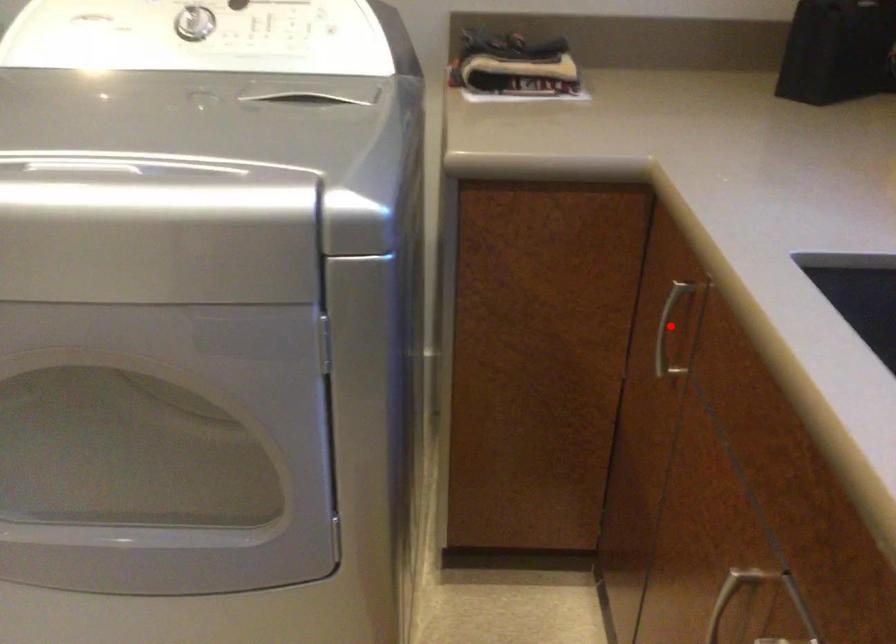
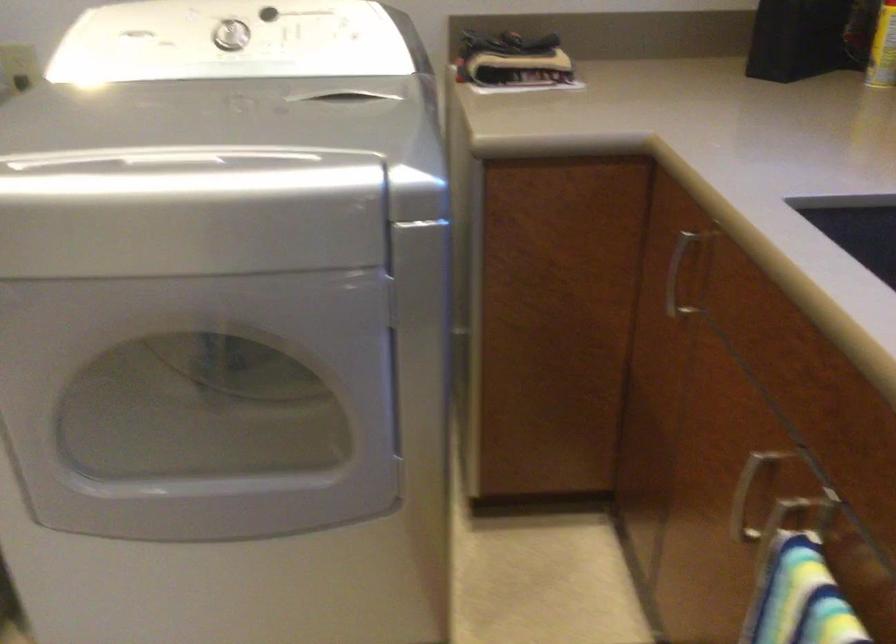
Question: I am providing you with two images of the same scene from different viewpoints. Image1 has a red point marked. In image2, the corresponding 3D location appears at what relative position? Reply with the corresponding letter.

Choices:
 (A) Closer
 (B) Farther

Answer: (B)